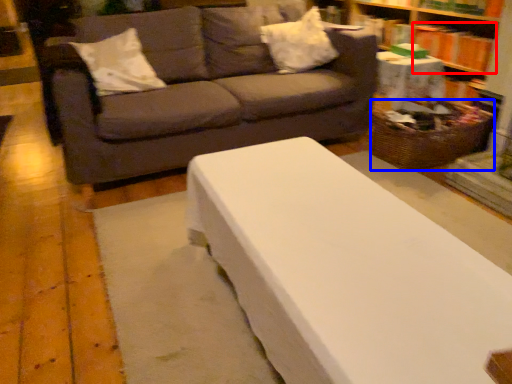
Question: Which point is further to the camera, book (highlighted by a red box) or basket (highlighted by a blue box)?

Choices:
 (A) book
 (B) basket

Answer: (A)